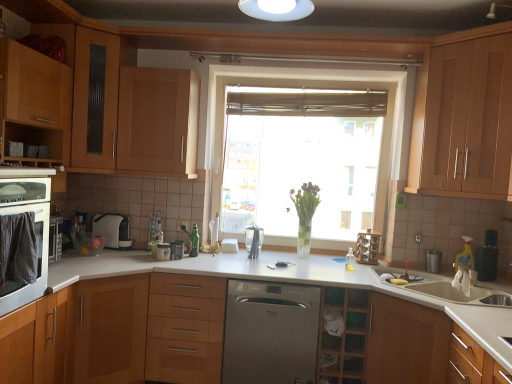
The height and width of the screenshot is (384, 512). Find the location of `vacant area that is in front of green plastic faucet at center`. vacant area that is in front of green plastic faucet at center is located at coordinates (193, 260).